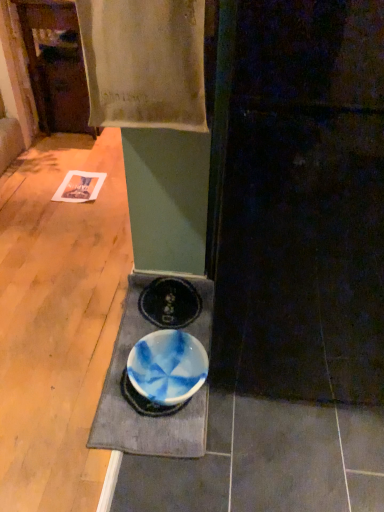
Image resolution: width=384 pixels, height=512 pixels. I want to click on free space to the left of blue glossy bowl at center, so click(52, 370).